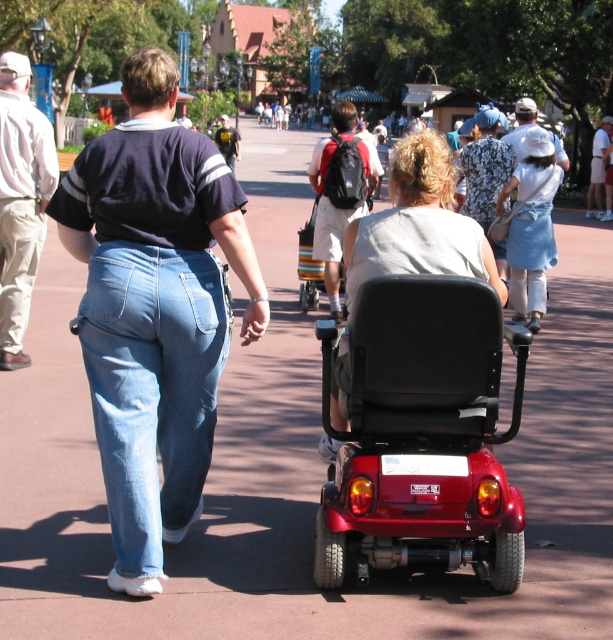
Question: Which of the following is the farthest from the observer?

Choices:
 (A) (326, 204)
 (B) (549, 157)
 (C) (495, 272)
 (D) (557, 163)

Answer: (D)

Question: Is blue denim jeans at center smaller than matte black scooter at center?

Choices:
 (A) yes
 (B) no

Answer: (A)

Question: Estimate the real-world distances between objects in this image. Which object is farther from the light beige cotton pants at left?

Choices:
 (A) white denim skirt at center
 (B) floral fabric dress at center

Answer: (A)

Question: Which is nearer to the light beige cotton pants at left?

Choices:
 (A) white fabric hat at upper center
 (B) matte black scooter at center
 (C) floral fabric dress at center
 (D) metallic red wheelchair at center

Answer: (B)

Question: Does light blue denim jeans at center appear over dark blue shirt at upper center?

Choices:
 (A) no
 (B) yes

Answer: (A)

Question: Is light beige cotton pants at left to the right of dark blue shirt at upper center from the viewer's perspective?

Choices:
 (A) yes
 (B) no

Answer: (A)